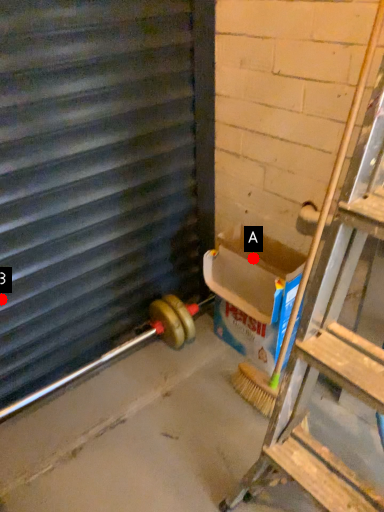
Question: Two points are circled on the image, labeled by A and B beside each circle. Which point is closer to the camera?

Choices:
 (A) A is closer
 (B) B is closer

Answer: (B)